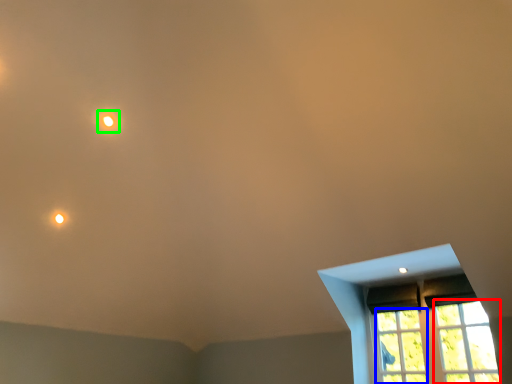
Question: Estimate the real-world distances between objects in this image. Which object is closer to glass window (highlighted by a red box), glass window (highlighted by a blue box) or light (highlighted by a green box)?

Choices:
 (A) glass window
 (B) light

Answer: (A)